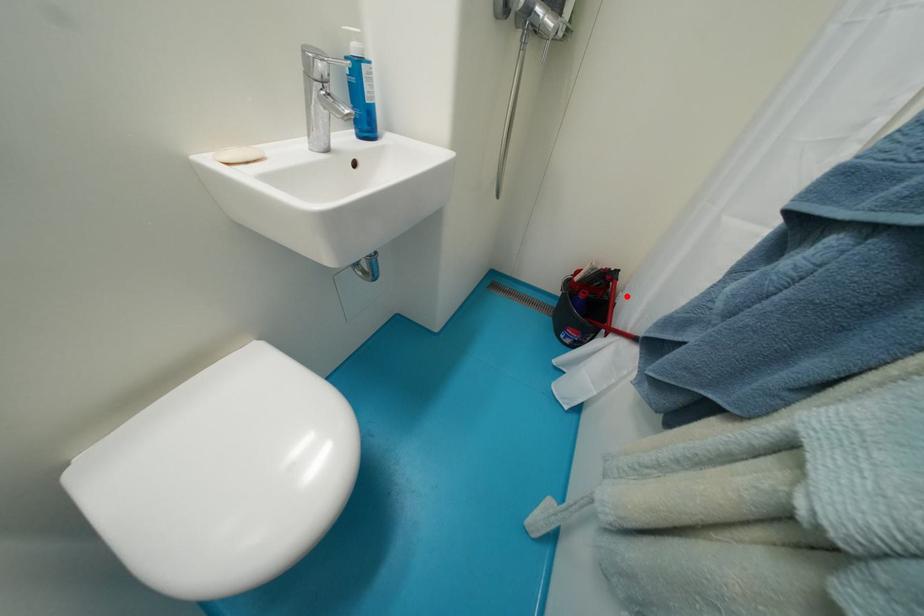
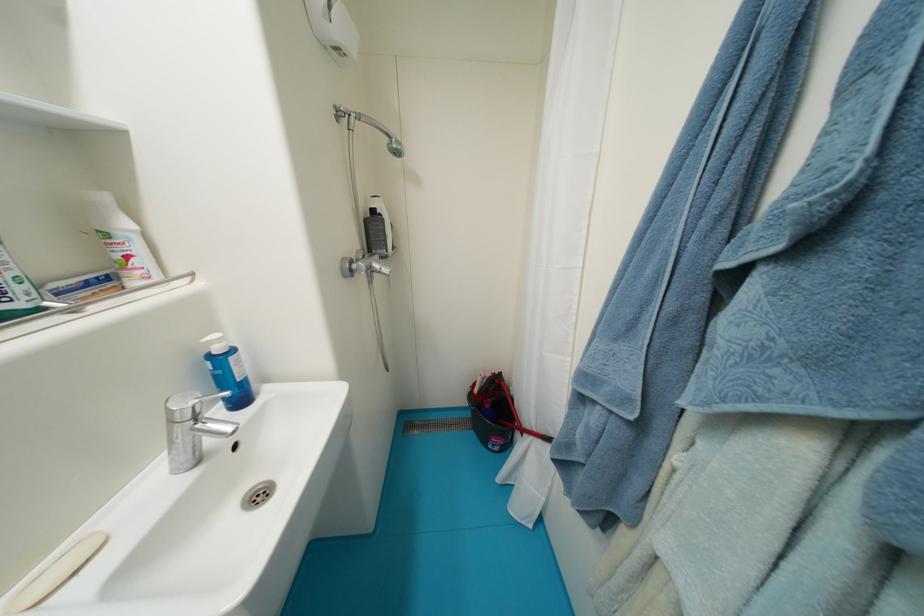
Question: I am providing you with two images of the same scene from different viewpoints. A red point is shown in image1. For the corresponding object point in image2, is it positioned nearer or farther from the camera?

Choices:
 (A) Nearer
 (B) Farther

Answer: (B)